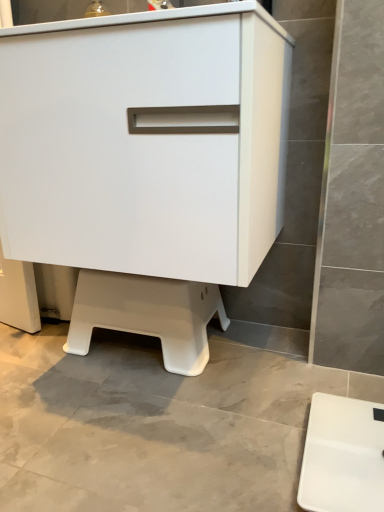
Question: Is white matte cabinet at center next to white plastic step stool at lower center and touching it?

Choices:
 (A) yes
 (B) no

Answer: (B)

Question: Does white matte cabinet at center have a greater height compared to white plastic step stool at lower center?

Choices:
 (A) yes
 (B) no

Answer: (A)

Question: Is white matte cabinet at center bigger than white plastic step stool at lower center?

Choices:
 (A) no
 (B) yes

Answer: (B)

Question: Can you confirm if white matte cabinet at center is smaller than white plastic step stool at lower center?

Choices:
 (A) no
 (B) yes

Answer: (A)

Question: From the image's perspective, is white matte cabinet at center under white plastic step stool at lower center?

Choices:
 (A) yes
 (B) no

Answer: (B)

Question: In the image, is white plastic step stool at lower center positioned in front of or behind white matte cabinet at center?

Choices:
 (A) front
 (B) behind

Answer: (B)

Question: In terms of height, does white plastic step stool at lower center look taller or shorter compared to white matte cabinet at center?

Choices:
 (A) tall
 (B) short

Answer: (B)

Question: Looking at the image, does white plastic step stool at lower center seem bigger or smaller compared to white matte cabinet at center?

Choices:
 (A) small
 (B) big

Answer: (A)

Question: Considering the positions of point (120, 280) and point (182, 273), is point (120, 280) closer or farther from the camera than point (182, 273)?

Choices:
 (A) farther
 (B) closer

Answer: (A)

Question: Is white matte cabinet at center wider or thinner than white plastic scale at lower right?

Choices:
 (A) wide
 (B) thin

Answer: (A)

Question: From the image's perspective, relative to white plastic scale at lower right, is white matte cabinet at center above or below?

Choices:
 (A) above
 (B) below

Answer: (A)

Question: Considering their positions, is white matte cabinet at center located in front of or behind white plastic scale at lower right?

Choices:
 (A) behind
 (B) front

Answer: (A)

Question: Would you say white matte cabinet at center is to the left or to the right of white plastic scale at lower right in the picture?

Choices:
 (A) right
 (B) left

Answer: (B)

Question: In terms of width, does white matte cabinet at center look wider or thinner when compared to white plastic step stool at lower center?

Choices:
 (A) wide
 (B) thin

Answer: (A)

Question: Would you say white matte cabinet at center is to the left or to the right of white plastic step stool at lower center in the picture?

Choices:
 (A) left
 (B) right

Answer: (B)